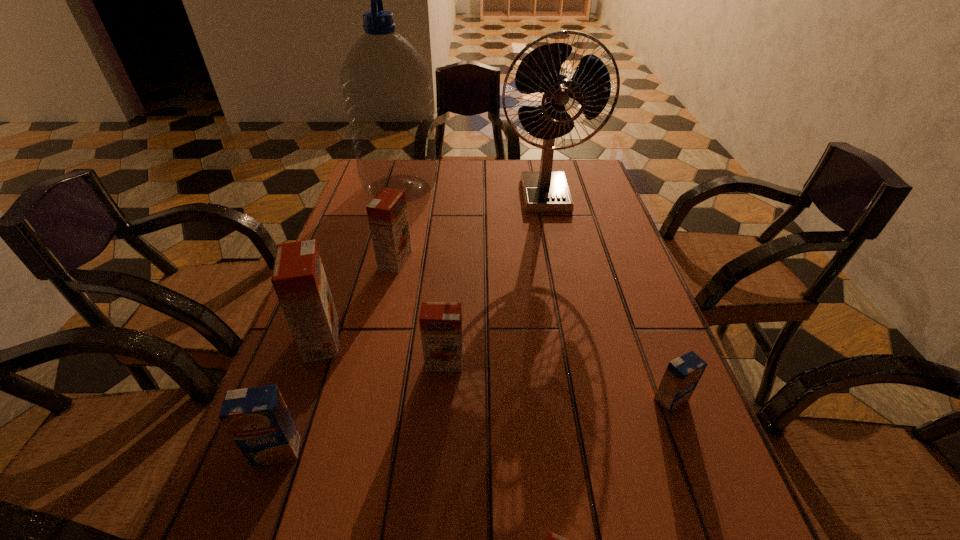
Where is `fan that is at the far edge`? fan that is at the far edge is located at coordinates (545, 191).

Locate an element on the screen. The image size is (960, 540). water jug located in the left edge section of the desktop is located at coordinates (386, 83).

This screenshot has width=960, height=540. Identify the location of fan positioned at the right edge. (545, 191).

The height and width of the screenshot is (540, 960). I want to click on orange_juice that is positioned at the right edge, so pyautogui.click(x=682, y=375).

At what (x,y) coordinates should I click in order to perform the action: click on object present at the far left corner. Please return your answer as a coordinate pair (x, y). Looking at the image, I should click on coord(386,83).

In order to click on object positioned at the far right corner in this screenshot , I will do `click(545, 191)`.

Where is `free space at the far edge of the desktop`? The width and height of the screenshot is (960, 540). free space at the far edge of the desktop is located at coordinates (471, 194).

This screenshot has width=960, height=540. Identify the location of free space at the left edge of the desktop. (357, 219).

Image resolution: width=960 pixels, height=540 pixels. In the image, there is a desktop. In order to click on free space at the right edge in this screenshot , I will do `click(626, 332)`.

Image resolution: width=960 pixels, height=540 pixels. In the image, there is a desktop. In order to click on vacant space at the far right corner in this screenshot , I will do `click(565, 164)`.